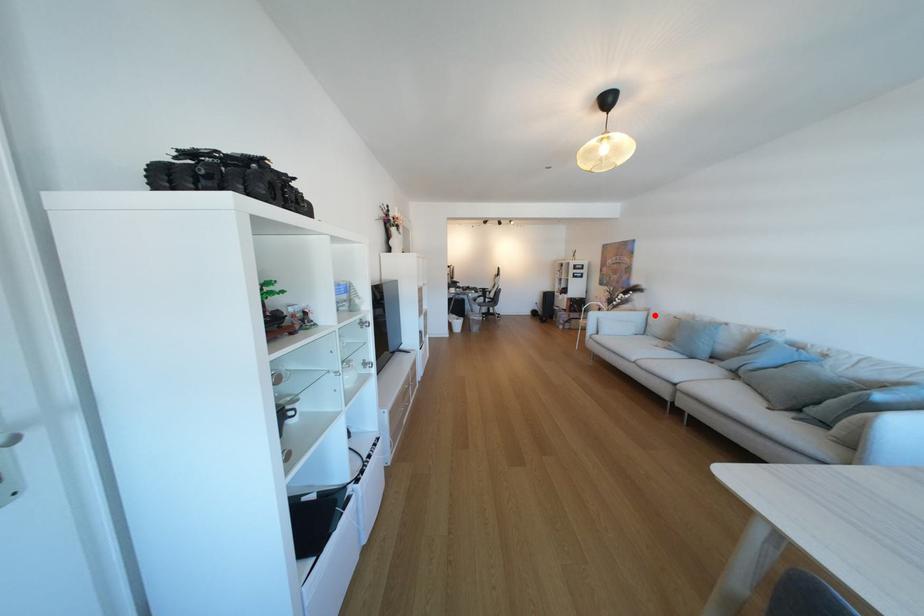
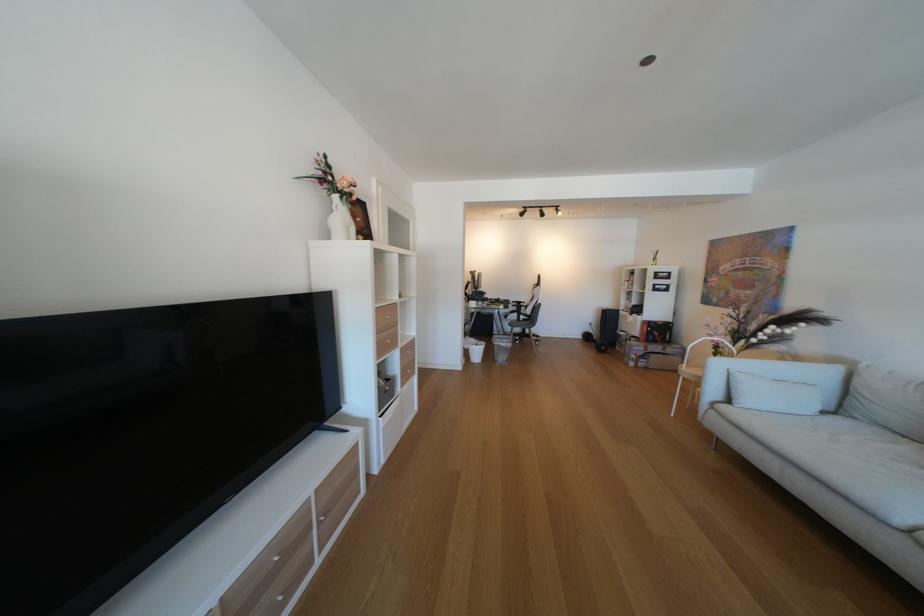
The point at the highlighted location is marked in the first image. Where is the corresponding point in the second image?

(845, 371)